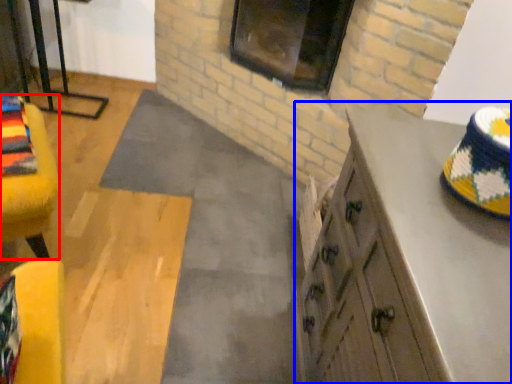
Question: Which object appears farthest to the camera in this image, furniture (highlighted by a red box) or cabinetry (highlighted by a blue box)?

Choices:
 (A) furniture
 (B) cabinetry

Answer: (A)